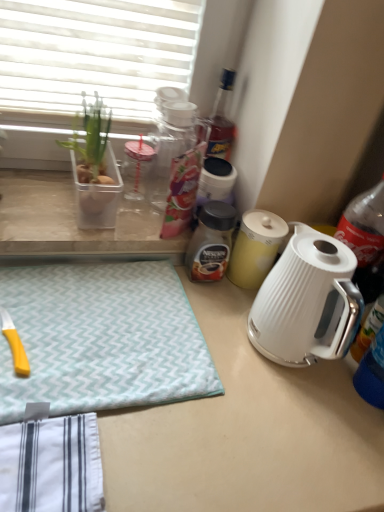
I want to click on vacant area that lies in front of clear plastic container at upper left, so click(51, 225).